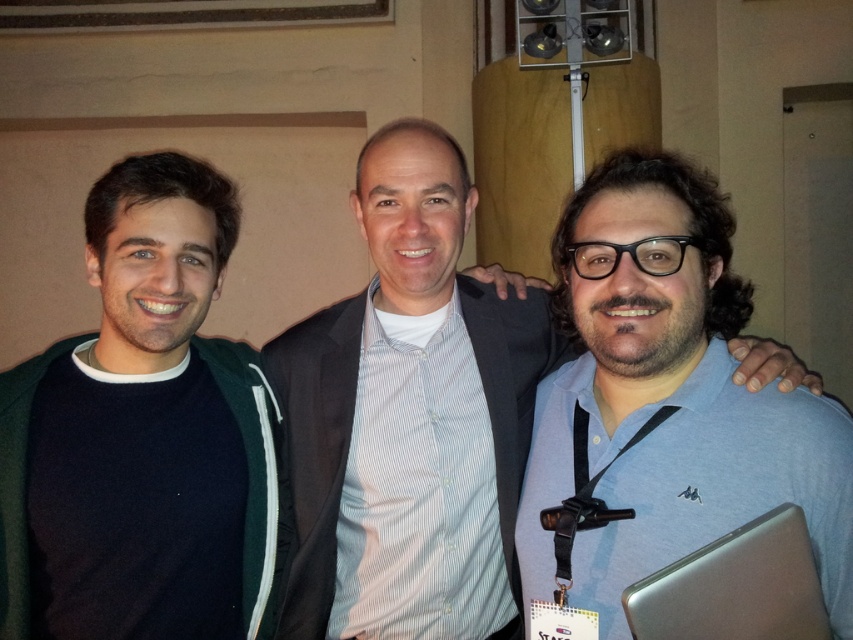
Based on the photo, does blue fabric shirt at right come behind blue striped shirt at center?

No, blue fabric shirt at right is in front of blue striped shirt at center.

Which is above, blue fabric shirt at right or blue striped shirt at center?

blue fabric shirt at right is higher up.

Locate an element on the screen. Image resolution: width=853 pixels, height=640 pixels. blue fabric shirt at right is located at coordinates (666, 401).

In order to click on blue fabric shirt at right in this screenshot , I will do `click(666, 401)`.

Is dark green sweater at left thinner than blue striped shirt at center?

Indeed, dark green sweater at left has a lesser width compared to blue striped shirt at center.

Where is `dark green sweater at left`? dark green sweater at left is located at coordinates (142, 435).

Is point (164, 374) positioned before point (306, 330)?

Yes, point (164, 374) is closer to viewer.

Identify the location of dark green sweater at left. (142, 435).

Looking at this image, who is higher up, blue striped shirt at center or silver metallic laptop at lower right?

blue striped shirt at center is higher up.

Does point (312, 506) come behind point (682, 582)?

Yes, point (312, 506) is farther from viewer.

Find the location of a particular element. This screenshot has height=640, width=853. blue striped shirt at center is located at coordinates (399, 368).